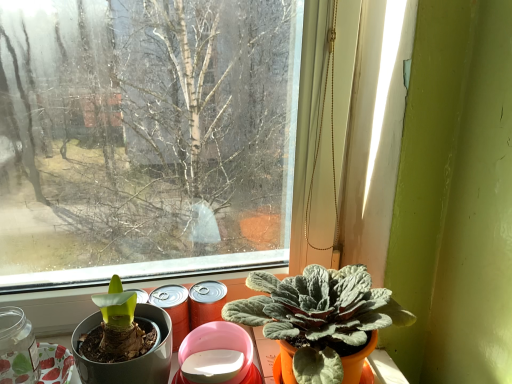
Find the location of a particular element. transparent glass jar at lower left is located at coordinates (17, 348).

What do you see at coordinates (17, 348) in the screenshot?
I see `transparent glass jar at lower left` at bounding box center [17, 348].

At what (x,y) coordinates should I click in order to perform the action: click on silvery-green felt-like plant at lower right. Please return your answer as a coordinate pair (x, y). Looking at the image, I should click on (320, 319).

What is the approximate height of silvery-green felt-like plant at lower right?

It is 9.45 inches.

Describe the element at coordinates (320, 319) in the screenshot. I see `silvery-green felt-like plant at lower right` at that location.

At what (x,y) coordinates should I click in order to perform the action: click on transparent glass jar at lower left. Please return your answer as a coordinate pair (x, y). The height and width of the screenshot is (384, 512). Looking at the image, I should click on (17, 348).

Can you confirm if transparent glass jar at lower left is positioned to the right of silvery-green felt-like plant at lower right?

No, transparent glass jar at lower left is not to the right of silvery-green felt-like plant at lower right.

Which object is closer to the camera, transparent glass jar at lower left or silvery-green felt-like plant at lower right?

silvery-green felt-like plant at lower right is in front.

Is point (3, 371) farther from camera compared to point (372, 341)?

Yes, point (3, 371) is farther from viewer.

From the image's perspective, which one is positioned lower, transparent glass jar at lower left or silvery-green felt-like plant at lower right?

From the image's view, transparent glass jar at lower left is below.

From a real-world perspective, between transparent glass jar at lower left and silvery-green felt-like plant at lower right, who is vertically higher?

silvery-green felt-like plant at lower right, from a real-world perspective.

Consider the image. Looking at their sizes, would you say transparent glass jar at lower left is wider or thinner than silvery-green felt-like plant at lower right?

In the image, transparent glass jar at lower left appears to be more narrow than silvery-green felt-like plant at lower right.

Considering the sizes of objects transparent glass jar at lower left and silvery-green felt-like plant at lower right in the image provided, who is taller, transparent glass jar at lower left or silvery-green felt-like plant at lower right?

Standing taller between the two is silvery-green felt-like plant at lower right.

Considering the relative sizes of transparent glass jar at lower left and silvery-green felt-like plant at lower right in the image provided, is transparent glass jar at lower left bigger than silvery-green felt-like plant at lower right?

No.

Is transparent glass jar at lower left located outside silvery-green felt-like plant at lower right?

Yes, transparent glass jar at lower left is not within silvery-green felt-like plant at lower right.

Would you say transparent glass jar at lower left is a long distance from silvery-green felt-like plant at lower right?

No, transparent glass jar at lower left is not far from silvery-green felt-like plant at lower right.

Is transparent glass jar at lower left oriented towards silvery-green felt-like plant at lower right?

No, transparent glass jar at lower left is not facing towards silvery-green felt-like plant at lower right.

You are a GUI agent. You are given a task and a screenshot of the screen. Output one action in this format:
    pyautogui.click(x=<x>, y=<y>)
    Task: Click on the houseplant located in front of the transparent glass jar at lower left
    
    Given the screenshot: What is the action you would take?
    pyautogui.click(x=320, y=319)

Considering the relative positions of silvery-green felt-like plant at lower right and transparent glass jar at lower left in the image provided, is silvery-green felt-like plant at lower right to the left or to the right of transparent glass jar at lower left?

Clearly, silvery-green felt-like plant at lower right is on the right of transparent glass jar at lower left in the image.

Is the depth of silvery-green felt-like plant at lower right greater than that of transparent glass jar at lower left?

No, the depth of silvery-green felt-like plant at lower right is less than that of transparent glass jar at lower left.

Does point (336, 332) appear closer or farther from the camera than point (20, 347)?

Point (336, 332) appears to be closer to the viewer than point (20, 347).

From the image's perspective, between silvery-green felt-like plant at lower right and transparent glass jar at lower left, who is located below?

transparent glass jar at lower left appears lower in the image.

From a real-world perspective, which is physically above, silvery-green felt-like plant at lower right or transparent glass jar at lower left?

In real-world perspective, silvery-green felt-like plant at lower right is above.

Does silvery-green felt-like plant at lower right have a greater width compared to transparent glass jar at lower left?

Indeed, silvery-green felt-like plant at lower right has a greater width compared to transparent glass jar at lower left.

Can you confirm if silvery-green felt-like plant at lower right is shorter than transparent glass jar at lower left?

In fact, silvery-green felt-like plant at lower right may be taller than transparent glass jar at lower left.

Considering the relative sizes of silvery-green felt-like plant at lower right and transparent glass jar at lower left in the image provided, is silvery-green felt-like plant at lower right smaller than transparent glass jar at lower left?

No.

Would you say transparent glass jar at lower left is part of silvery-green felt-like plant at lower right's contents?

No.

From the picture: Is silvery-green felt-like plant at lower right positioned far away from transparent glass jar at lower left?

They are positioned close to each other.

Could you tell me if silvery-green felt-like plant at lower right is facing transparent glass jar at lower left?

No, silvery-green felt-like plant at lower right is not aimed at transparent glass jar at lower left.

What's the angular difference between silvery-green felt-like plant at lower right and transparent glass jar at lower left's facing directions?

The facing directions of silvery-green felt-like plant at lower right and transparent glass jar at lower left are 1.07 degrees apart.

You are a GUI agent. You are given a task and a screenshot of the screen. Output one action in this format:
    pyautogui.click(x=<x>, y=<y>)
    Task: Click on the houseplant above the transparent glass jar at lower left (from the image's perspective)
    
    Given the screenshot: What is the action you would take?
    pyautogui.click(x=320, y=319)

Locate an element on the screen. This screenshot has width=512, height=384. glass jar behind the silvery-green felt-like plant at lower right is located at coordinates (17, 348).

I want to click on houseplant located above the transparent glass jar at lower left (from a real-world perspective), so click(320, 319).